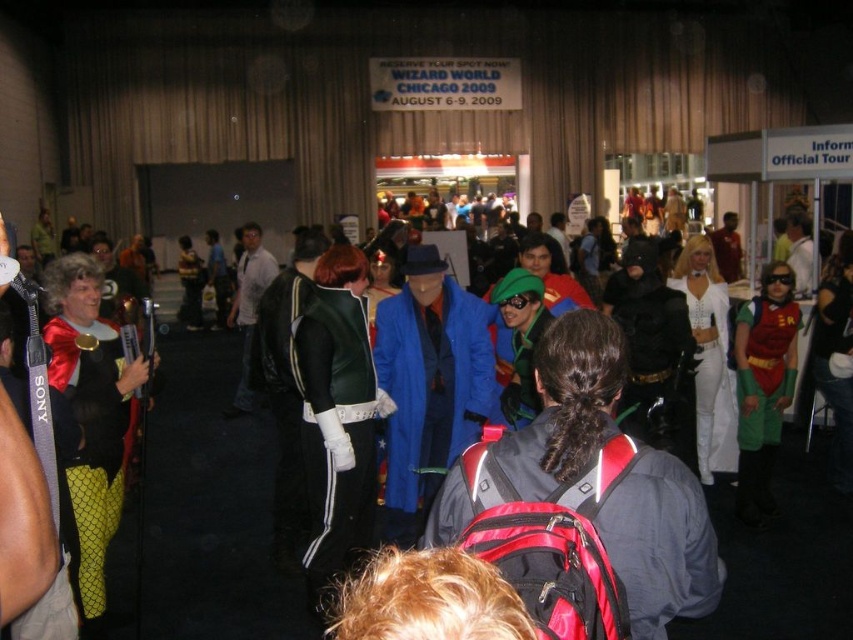
Question: Which point is farther from the camera taking this photo?

Choices:
 (A) (833, 596)
 (B) (695, 556)
 (C) (457, 396)
 (D) (334, 333)

Answer: (C)

Question: Is green fabric cape at center wider than blue fabric coat at center?

Choices:
 (A) no
 (B) yes

Answer: (B)

Question: Can you confirm if red synthetic backpack at center is positioned above white leather pants at center?

Choices:
 (A) no
 (B) yes

Answer: (A)

Question: Which point is farther to the camera?

Choices:
 (A) (651, 468)
 (B) (309, 481)
 (C) (723, 372)

Answer: (C)

Question: Among these points, which one is farthest from the camera?

Choices:
 (A) (422, 536)
 (B) (161, 618)
 (C) (341, 340)
 (D) (691, 308)

Answer: (D)

Question: Is green fabric cape at center positioned in front of red synthetic backpack at center?

Choices:
 (A) no
 (B) yes

Answer: (A)